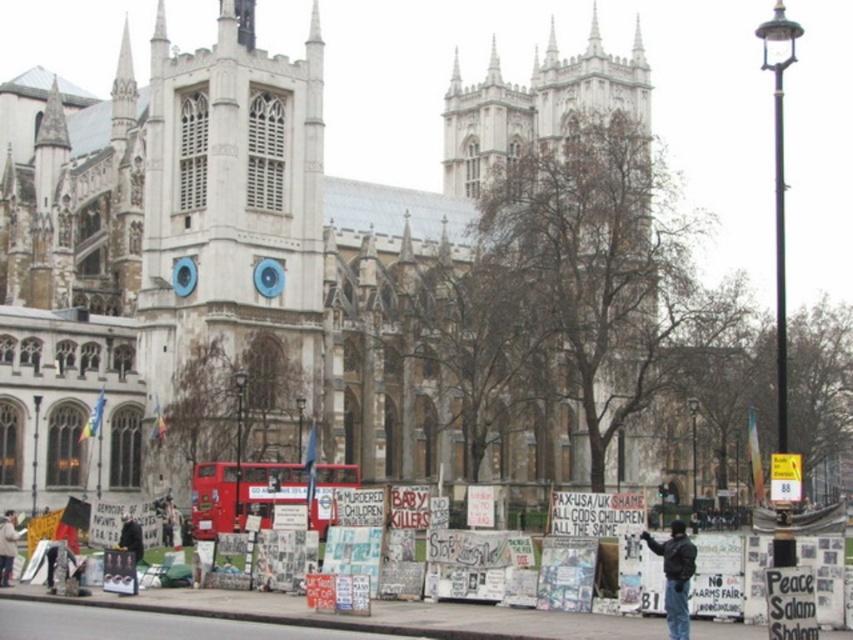
You are standing at the point closest to the cathedral facade. Which of the two points, point (405, 353) or point (677, 588), is farther from your current position?

Point (677, 588) is farther from your current position because it is in front of point (405, 353), meaning the latter is closer to the cathedral facade where you are standing.